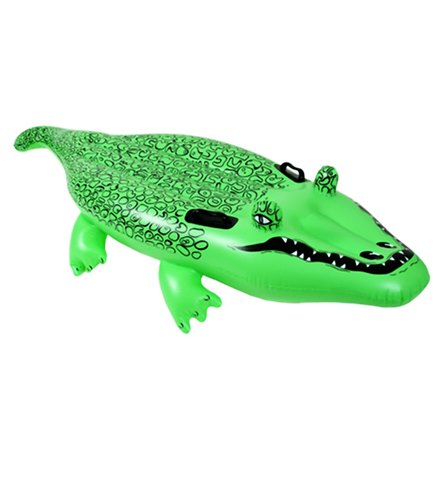
Where is `handles`? handles is located at coordinates (287, 166), (211, 217).